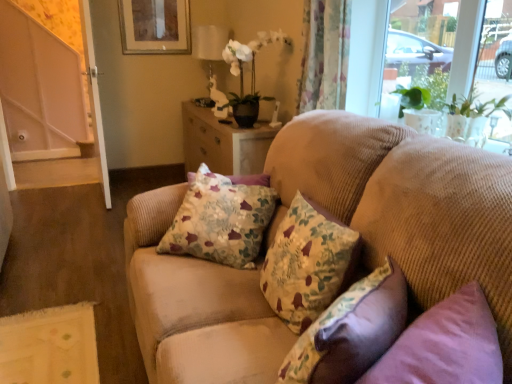
Question: From the image's perspective, does floral fabric cushion at center, which is the third pillow from front to back, appear higher than beige corduroy couch at center?

Choices:
 (A) no
 (B) yes

Answer: (B)

Question: Does floral fabric cushion at center, the first pillow positioned from the back, come behind beige corduroy couch at center?

Choices:
 (A) no
 (B) yes

Answer: (B)

Question: Is floral fabric cushion at center, which is the third pillow from front to back, completely or partially outside of beige corduroy couch at center?

Choices:
 (A) yes
 (B) no

Answer: (B)

Question: From a real-world perspective, does floral fabric cushion at center, the first pillow positioned from the back, stand above beige corduroy couch at center?

Choices:
 (A) no
 (B) yes

Answer: (B)

Question: Is floral fabric cushion at center, which is the third pillow from front to back, with beige corduroy couch at center?

Choices:
 (A) yes
 (B) no

Answer: (B)

Question: From the image's perspective, is white glossy screen door at left, which ranks as the 1th screen door in left-to-right order, located above or below beige corduroy couch at center?

Choices:
 (A) above
 (B) below

Answer: (A)

Question: Relative to beige corduroy couch at center, is white glossy screen door at left, which is counted as the second screen door, starting from the right, in front or behind?

Choices:
 (A) behind
 (B) front

Answer: (A)

Question: From a real-world perspective, is white glossy screen door at left, which ranks as the 1th screen door in left-to-right order, above or below beige corduroy couch at center?

Choices:
 (A) above
 (B) below

Answer: (A)

Question: Is white glossy screen door at left, which is counted as the second screen door, starting from the right, inside the boundaries of beige corduroy couch at center, or outside?

Choices:
 (A) inside
 (B) outside

Answer: (B)

Question: Based on their sizes in the image, would you say matte wooden picture frame at upper center is bigger or smaller than floral fabric pillow at center, the 2th pillow viewed from the back?

Choices:
 (A) big
 (B) small

Answer: (B)

Question: Is matte wooden picture frame at upper center situated inside floral fabric pillow at center, the 2th pillow viewed from the back, or outside?

Choices:
 (A) inside
 (B) outside

Answer: (B)

Question: Does point (163, 1) appear closer or farther from the camera than point (346, 258)?

Choices:
 (A) closer
 (B) farther

Answer: (B)

Question: Is matte wooden picture frame at upper center to the left or to the right of floral fabric pillow at center, arranged as the 2th pillow when viewed from the front, in the image?

Choices:
 (A) left
 (B) right

Answer: (A)

Question: In terms of size, does floral fabric cushion at center, which is the third pillow from front to back, appear bigger or smaller than white glossy door at left, which ranks as the 1th screen door in right-to-left order?

Choices:
 (A) small
 (B) big

Answer: (A)

Question: Considering the positions of floral fabric cushion at center, the first pillow positioned from the back, and white glossy door at left, which ranks as the 1th screen door in right-to-left order, in the image, is floral fabric cushion at center, the first pillow positioned from the back, wider or thinner than white glossy door at left, which ranks as the 1th screen door in right-to-left order,?

Choices:
 (A) wide
 (B) thin

Answer: (A)